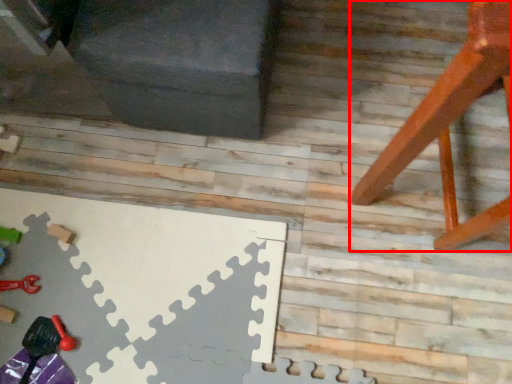
Question: Observing the image, what is the correct spatial positioning of furniture (annotated by the red box) in reference to toy?

Choices:
 (A) left
 (B) right

Answer: (B)